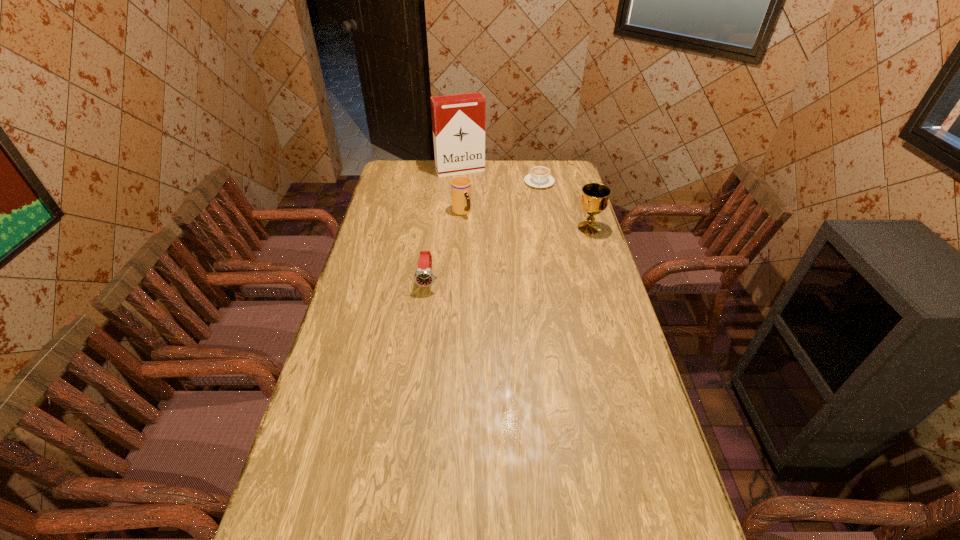
You are a GUI agent. You are given a task and a screenshot of the screen. Output one action in this format:
    pyautogui.click(x=<x>, y=<y>)
    Task: Click on the fourth tallest object
    The height and width of the screenshot is (540, 960).
    Given the screenshot: What is the action you would take?
    pyautogui.click(x=423, y=276)

Locate an element on the screen. watch is located at coordinates (423, 276).

Where is `the second nearest object`? Image resolution: width=960 pixels, height=540 pixels. the second nearest object is located at coordinates (594, 200).

What are the coordinates of `the fourth shortest object` in the screenshot? It's located at (594, 200).

Identify the location of the shortest object. Image resolution: width=960 pixels, height=540 pixels. (540, 177).

Where is `cappuccino`? The width and height of the screenshot is (960, 540). cappuccino is located at coordinates tap(540, 177).

The image size is (960, 540). I want to click on cup, so click(460, 186).

At what (x,y) coordinates should I click in order to perform the action: click on the third shortest object. Please return your answer as a coordinate pair (x, y). Looking at the image, I should click on (460, 186).

Locate an element on the screen. Image resolution: width=960 pixels, height=540 pixels. the tallest object is located at coordinates (458, 121).

Image resolution: width=960 pixels, height=540 pixels. I want to click on free point located 0.070m on the face of the watch, so 424,307.